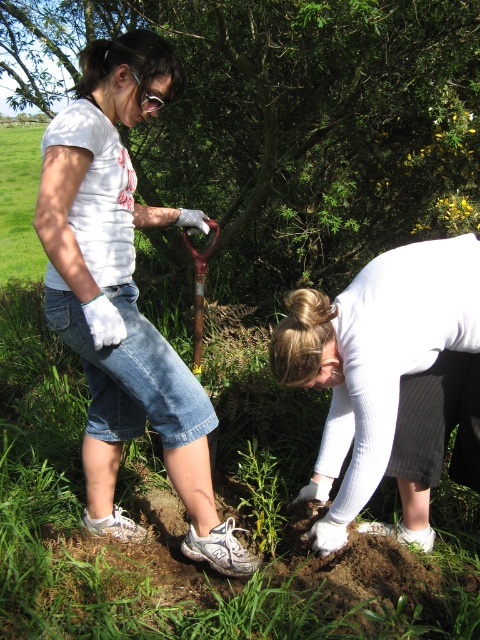
Question: Is green matte tree at upper center bigger than white textured sweater at lower center?

Choices:
 (A) no
 (B) yes

Answer: (B)

Question: Among these objects, which one is nearest to the camera?

Choices:
 (A) green matte tree at upper center
 (B) white matte t-shirt at upper left

Answer: (B)

Question: From the image, what is the correct spatial relationship of green matte tree at upper center in relation to white matte t-shirt at upper left?

Choices:
 (A) above
 (B) below

Answer: (A)

Question: Can you confirm if white matte t-shirt at upper left is bigger than white textured sweater at lower center?

Choices:
 (A) no
 (B) yes

Answer: (B)

Question: Which object appears closest to the camera in this image?

Choices:
 (A) white matte t-shirt at upper left
 (B) wooden shovel at center
 (C) green matte tree at upper center
 (D) white textured sweater at lower center

Answer: (A)

Question: Among these objects, which one is farthest from the camera?

Choices:
 (A) green matte tree at upper center
 (B) wooden shovel at center

Answer: (A)